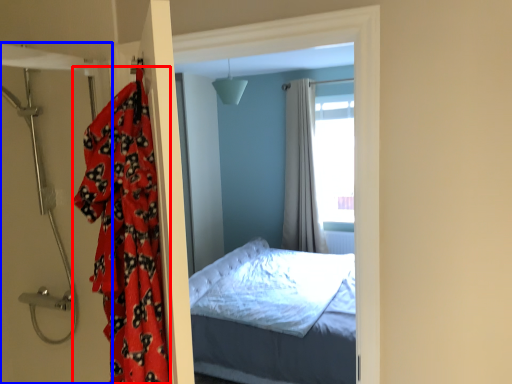
Question: Which object is closer to the camera taking this photo, blanket (highlighted by a red box) or door (highlighted by a blue box)?

Choices:
 (A) blanket
 (B) door

Answer: (A)